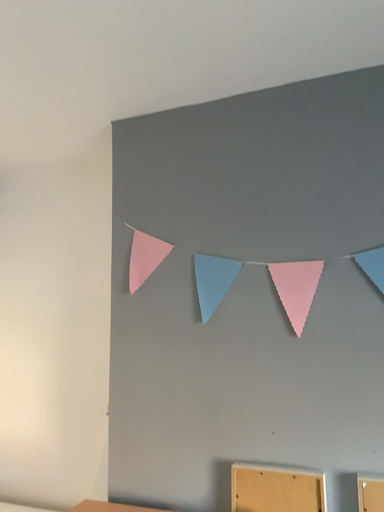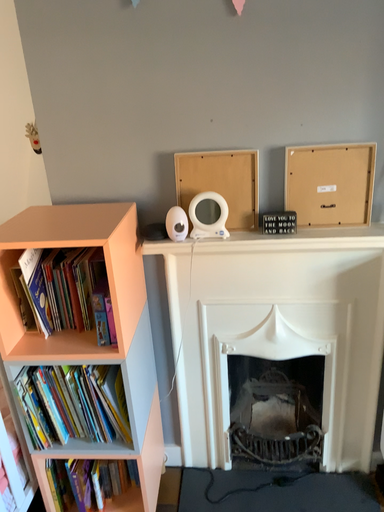
Question: Which way did the camera rotate in the video?

Choices:
 (A) rotated left
 (B) rotated right

Answer: (B)